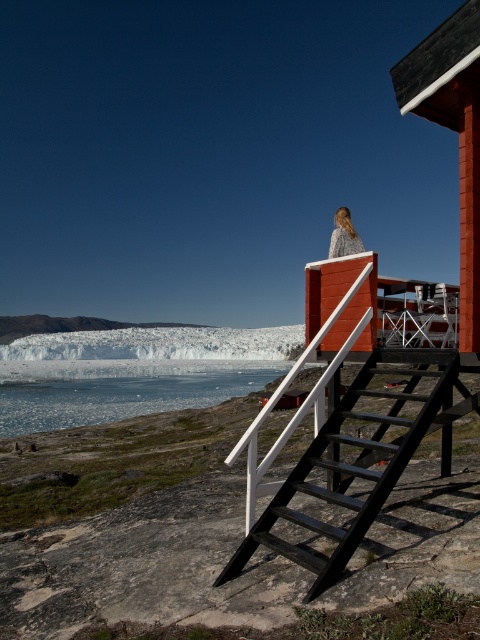
Question: Which is nearer to the smooth wood cabin at upper right?

Choices:
 (A) white ice at lower left
 (B) translucent ice at lower center

Answer: (B)

Question: Considering the relative positions of white ice at lower left and blonde hair at upper center in the image provided, where is white ice at lower left located with respect to blonde hair at upper center?

Choices:
 (A) above
 (B) below

Answer: (B)

Question: Does smooth wood cabin at upper right appear on the left side of white ice at lower left?

Choices:
 (A) yes
 (B) no

Answer: (B)

Question: Which object is farther from the camera taking this photo?

Choices:
 (A) smooth wood cabin at upper right
 (B) white ice at lower left

Answer: (B)

Question: Among these objects, which one is nearest to the camera?

Choices:
 (A) black wood stairs at upper center
 (B) smooth wood cabin at upper right

Answer: (A)

Question: Is black wood stairs at upper center to the left of white ice at lower left from the viewer's perspective?

Choices:
 (A) yes
 (B) no

Answer: (B)